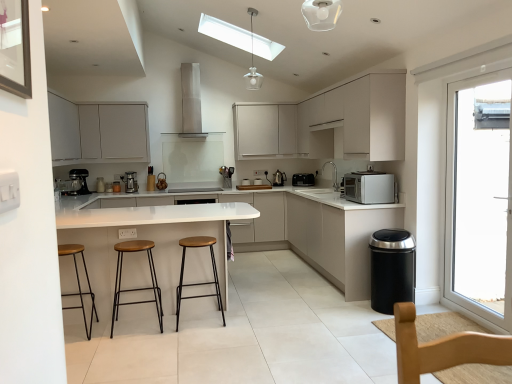
Question: From the image's perspective, is polished stainless steel kettle at center-right, the 1th appliance from the left, above or below wooden seat metal frame stool at left, which is the 1th stool from left to right?

Choices:
 (A) below
 (B) above

Answer: (B)

Question: Is polished stainless steel kettle at center-right, the second appliance from the right, in front of or behind wooden seat metal frame stool at left, which is the 1th stool from left to right, in the image?

Choices:
 (A) behind
 (B) front

Answer: (A)

Question: Which object is positioned closest to the wooden seat stool at center, placed as the 2th stool when sorted from left to right?

Choices:
 (A) transparent glass door at right
 (B) matte white cabinet at upper center, which appears as the 3th cabinetry when viewed from the left
 (C) wooden seat metal frame stool at left, which is the 1th stool from left to right
 (D) satin black coffee machine at center, the 2th coffee machine from the left
 (E) white glossy countertop at center

Answer: (C)

Question: Considering the real-world distances, which object is closest to the white matte cabinet at upper center, marked as the fourth cabinetry in a left-to-right arrangement?

Choices:
 (A) clear glass pendant light at upper center
 (B) satin silver toaster at center, which ranks as the 2th appliance in left-to-right order
 (C) matte white cabinets at upper left, the second cabinetry in the left-to-right sequence
 (D) polished stainless steel kettle at center-right, the second appliance from the right
 (E) white matte microwave at right

Answer: (D)